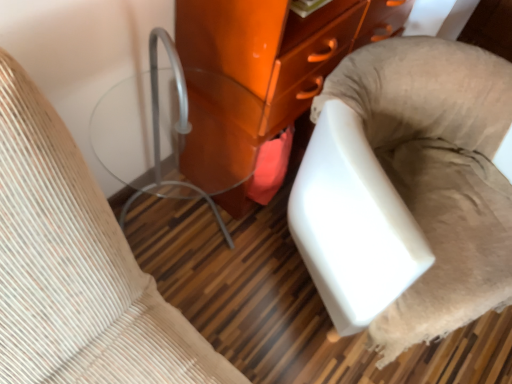
Question: Considering the relative sizes of white fabric chair at lower right, acting as the first furniture starting from the right, and matte glass side table at left, which is counted as the 3th furniture, starting from the right, in the image provided, is white fabric chair at lower right, acting as the first furniture starting from the right, smaller than matte glass side table at left, which is counted as the 3th furniture, starting from the right,?

Choices:
 (A) yes
 (B) no

Answer: (B)

Question: Considering the relative sizes of white fabric chair at lower right, acting as the first furniture starting from the right, and matte glass side table at left, the first furniture viewed from the left, in the image provided, is white fabric chair at lower right, acting as the first furniture starting from the right, bigger than matte glass side table at left, the first furniture viewed from the left,?

Choices:
 (A) no
 (B) yes

Answer: (B)

Question: Considering the relative sizes of white fabric chair at lower right, acting as the first furniture starting from the right, and matte glass side table at left, the first furniture viewed from the left, in the image provided, is white fabric chair at lower right, acting as the first furniture starting from the right, taller than matte glass side table at left, the first furniture viewed from the left,?

Choices:
 (A) yes
 (B) no

Answer: (B)

Question: Is white fabric chair at lower right, acting as the first furniture starting from the right, far from matte glass side table at left, which is counted as the 3th furniture, starting from the right?

Choices:
 (A) no
 (B) yes

Answer: (A)

Question: Is white fabric chair at lower right, positioned as the 3th furniture in left-to-right order, with matte glass side table at left, which is counted as the 3th furniture, starting from the right?

Choices:
 (A) yes
 (B) no

Answer: (B)

Question: Considering the positions of white fabric chair at lower right, positioned as the 3th furniture in left-to-right order, and glossy orange cabinet at center, which is the second furniture in right-to-left order, in the image, is white fabric chair at lower right, positioned as the 3th furniture in left-to-right order, taller or shorter than glossy orange cabinet at center, which is the second furniture in right-to-left order,?

Choices:
 (A) tall
 (B) short

Answer: (B)

Question: From a real-world perspective, is white fabric chair at lower right, acting as the first furniture starting from the right, physically located above or below glossy orange cabinet at center, which is the second furniture in right-to-left order?

Choices:
 (A) below
 (B) above

Answer: (A)

Question: In terms of size, does white fabric chair at lower right, acting as the first furniture starting from the right, appear bigger or smaller than glossy orange cabinet at center, which is the second furniture in right-to-left order?

Choices:
 (A) small
 (B) big

Answer: (A)

Question: From the image's perspective, relative to glossy orange cabinet at center, the 2th furniture viewed from the left, is white fabric chair at lower right, acting as the first furniture starting from the right, above or below?

Choices:
 (A) below
 (B) above

Answer: (A)

Question: Is glossy orange cabinet at center, which is the second furniture in right-to-left order, wider or thinner than white fabric chair at lower right, acting as the first furniture starting from the right?

Choices:
 (A) wide
 (B) thin

Answer: (B)

Question: Considering the positions of glossy orange cabinet at center, the 2th furniture viewed from the left, and white fabric chair at lower right, acting as the first furniture starting from the right, in the image, is glossy orange cabinet at center, the 2th furniture viewed from the left, taller or shorter than white fabric chair at lower right, acting as the first furniture starting from the right,?

Choices:
 (A) short
 (B) tall

Answer: (B)

Question: Is point (257, 44) closer or farther from the camera than point (406, 240)?

Choices:
 (A) closer
 (B) farther

Answer: (B)

Question: Considering the positions of glossy orange cabinet at center, which is the second furniture in right-to-left order, and white fabric chair at lower right, positioned as the 3th furniture in left-to-right order, in the image, is glossy orange cabinet at center, which is the second furniture in right-to-left order, bigger or smaller than white fabric chair at lower right, positioned as the 3th furniture in left-to-right order,?

Choices:
 (A) big
 (B) small

Answer: (A)

Question: Considering the positions of matte glass side table at left, which is counted as the 3th furniture, starting from the right, and glossy orange cabinet at center, which is the second furniture in right-to-left order, in the image, is matte glass side table at left, which is counted as the 3th furniture, starting from the right, taller or shorter than glossy orange cabinet at center, which is the second furniture in right-to-left order,?

Choices:
 (A) tall
 (B) short

Answer: (B)

Question: Considering the positions of matte glass side table at left, the first furniture viewed from the left, and glossy orange cabinet at center, the 2th furniture viewed from the left, in the image, is matte glass side table at left, the first furniture viewed from the left, bigger or smaller than glossy orange cabinet at center, the 2th furniture viewed from the left,?

Choices:
 (A) small
 (B) big

Answer: (A)